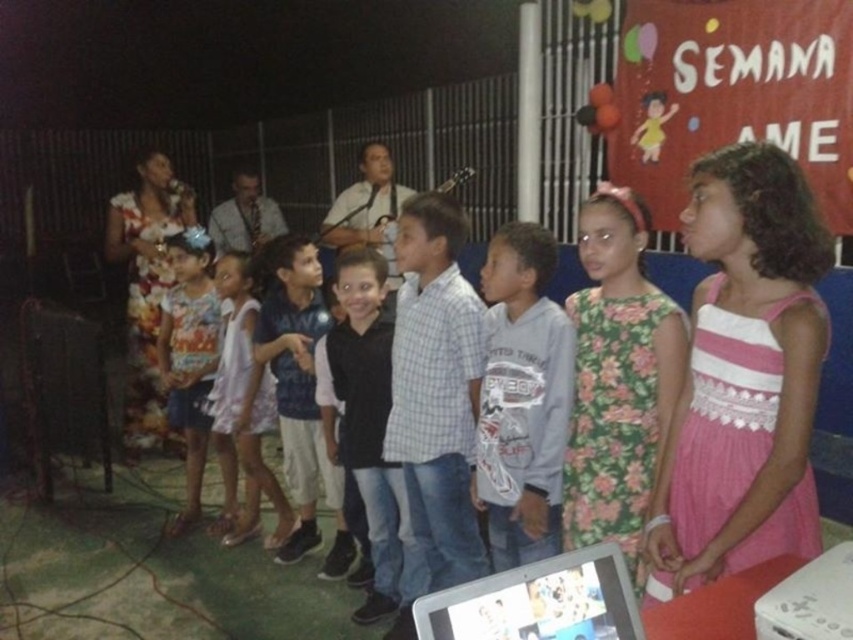
You are a photographer standing in front of the scene. You want to take a photo that includes both the point at (306, 252) and the point at (494, 611). Considering their positions, which point is closer to your camera lens?

Point at (306, 252) is closer to the camera lens because it is further to the viewer than point at (494, 611).

Based on the photo, you are a photographer trying to capture a clear shot of the gray cotton shirt at center and the silver plastic tablet at center. Based on their positions, which object should you focus on first to ensure both are in frame?

The gray cotton shirt at center is above the silver plastic tablet at center, so you should focus on the gray cotton shirt at center first to ensure both are in frame.